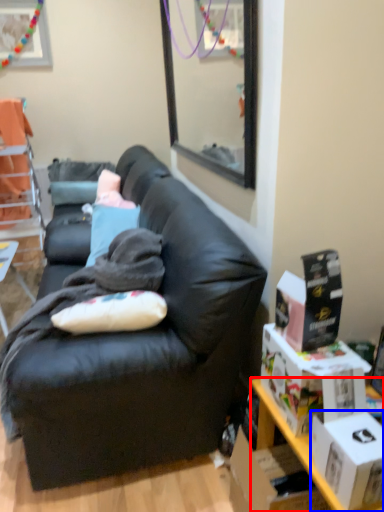
Question: Which point is closer to the camera, desk (highlighted by a red box) or box (highlighted by a blue box)?

Choices:
 (A) desk
 (B) box

Answer: (B)